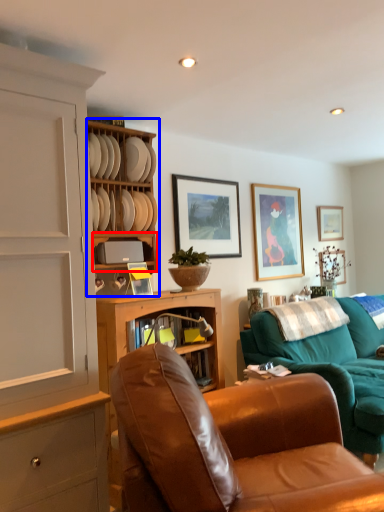
Question: Among these objects, which one is nearest to the camera, shelf (highlighted by a red box) or shelf (highlighted by a blue box)?

Choices:
 (A) shelf
 (B) shelf

Answer: (B)